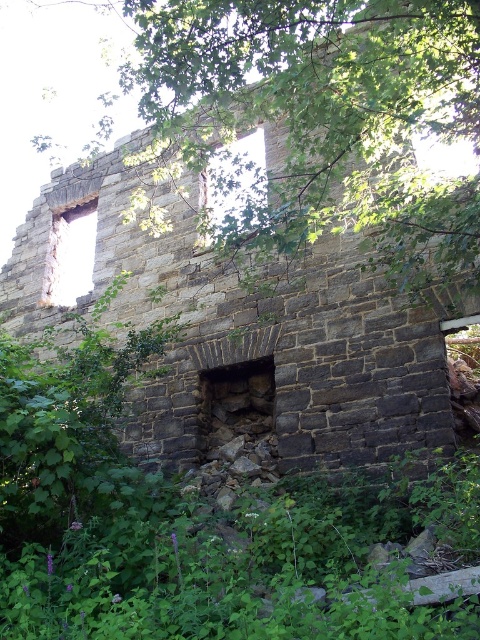
Is green leafy tree at upper center closer to camera compared to matte stone window at center?

Yes, it is.

Between point (317, 77) and point (253, 209), which one is positioned in front?

Point (317, 77)

You are a GUI agent. You are given a task and a screenshot of the screen. Output one action in this format:
    pyautogui.click(x=<x>, y=<y>)
    Task: Click on the green leafy tree at upper center
    
    Given the screenshot: What is the action you would take?
    pyautogui.click(x=308, y=60)

This screenshot has height=640, width=480. What do you see at coordinates (232, 186) in the screenshot? I see `matte stone window at center` at bounding box center [232, 186].

Does matte stone window at center come in front of transparent glass window at upper left?

Yes, matte stone window at center is closer to the viewer.

What are the coordinates of `matte stone window at center` in the screenshot? It's located at (232, 186).

Who is more distant from viewer, (381, 33) or (67, 232)?

Positioned behind is point (67, 232).

Is green leafy tree at upper center below transparent glass window at upper left?

No, green leafy tree at upper center is not below transparent glass window at upper left.

Is point (260, 76) positioned behind point (82, 224)?

No.

This screenshot has width=480, height=640. I want to click on green leafy tree at upper center, so click(x=308, y=60).